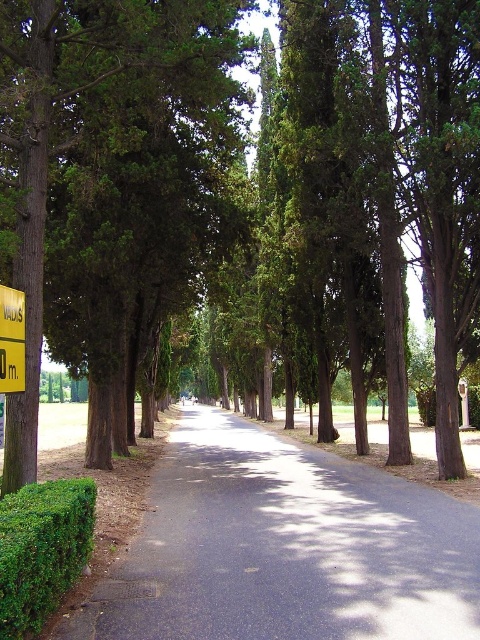
Question: Which is nearer to the green leafy hedge at lower left?

Choices:
 (A) dark asphalt road at center
 (B) yellow plastic sign at left

Answer: (B)

Question: Is dark asphalt road at center bigger than green leafy hedge at lower left?

Choices:
 (A) yes
 (B) no

Answer: (A)

Question: In this image, where is dark asphalt road at center located relative to yellow plastic sign at left?

Choices:
 (A) above
 (B) below

Answer: (B)

Question: Based on their relative distances, which object is nearer to the dark asphalt road at center?

Choices:
 (A) yellow plastic sign at left
 (B) green leafy hedge at lower left

Answer: (B)

Question: Based on their relative distances, which object is nearer to the green leafy hedge at lower left?

Choices:
 (A) dark asphalt road at center
 (B) yellow plastic sign at left

Answer: (B)

Question: Can you confirm if green leafy hedge at lower left is positioned to the right of yellow plastic sign at left?

Choices:
 (A) no
 (B) yes

Answer: (B)